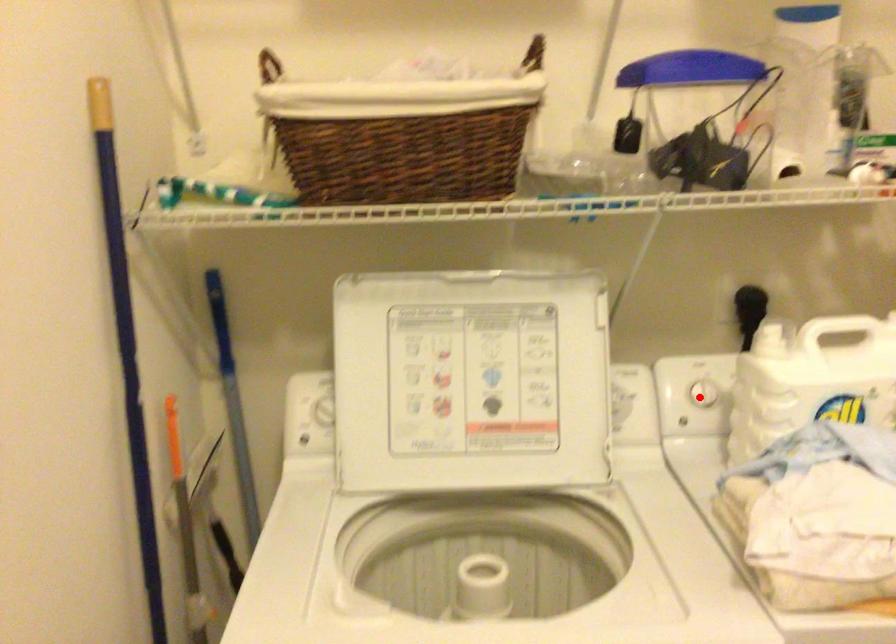
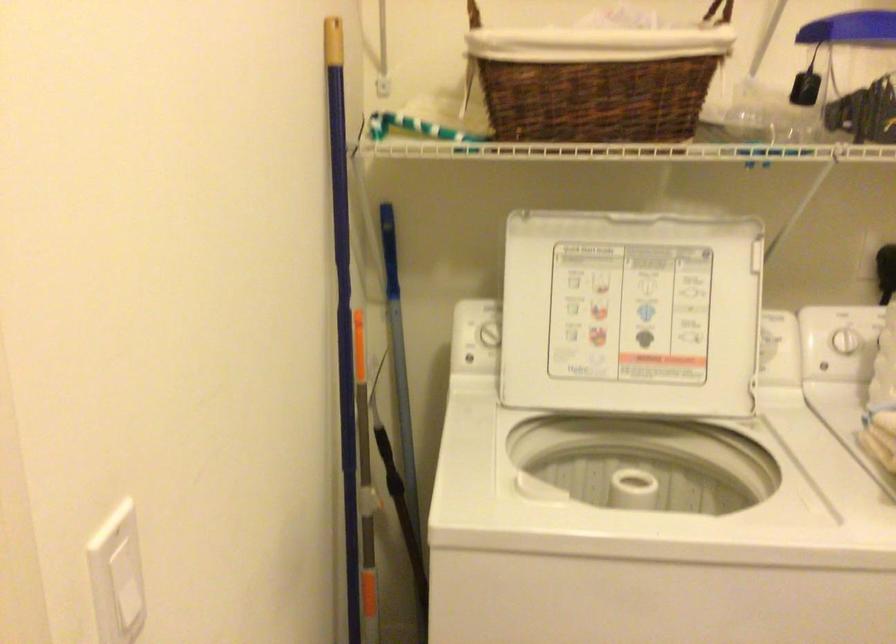
Find the pixel in the second image that matches the highlighted location in the first image.

(845, 341)